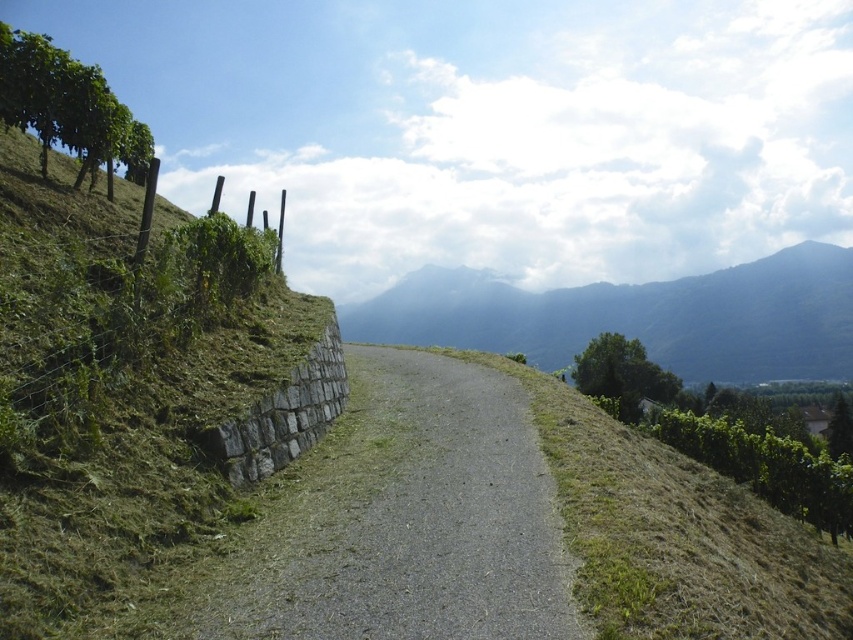
Does gray gravel path at center lie in front of grayish-blue mountain range at center?

Yes, it is in front of grayish-blue mountain range at center.

Locate an element on the screen. Image resolution: width=853 pixels, height=640 pixels. gray gravel path at center is located at coordinates (405, 518).

Which is in front, point (569, 572) or point (834, 269)?

Point (569, 572)

Identify the location of gray gravel path at center. (405, 518).